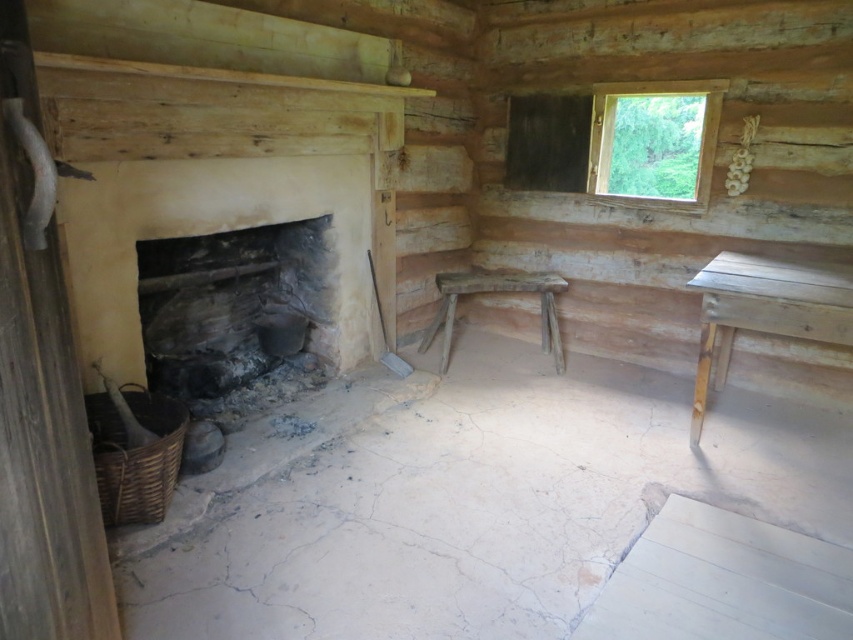
Who is positioned more to the right, charcoal gray stone fireplace at left or wooden table at right?

wooden table at right is more to the right.

Is charcoal gray stone fireplace at left thinner than wooden table at right?

Yes.

You are a GUI agent. You are given a task and a screenshot of the screen. Output one action in this format:
    pyautogui.click(x=<x>, y=<y>)
    Task: Click on the charcoal gray stone fireplace at left
    
    Given the screenshot: What is the action you would take?
    pyautogui.click(x=229, y=305)

Does point (283, 355) come farther from viewer compared to point (502, 278)?

No, (283, 355) is in front of (502, 278).

Is charcoal gray stone fireplace at left smaller than rustic wooden stool at center?

No.

Which is in front, point (173, 387) or point (561, 348)?

Positioned in front is point (173, 387).

This screenshot has height=640, width=853. I want to click on charcoal gray stone fireplace at left, so click(x=229, y=305).

Which is behind, point (328, 282) or point (662, 81)?

The point (662, 81) is behind.

Which of these two, charcoal gray stone fireplace at left or transparent wooden window at upper right, stands shorter?

With less height is transparent wooden window at upper right.

Where is `charcoal gray stone fireplace at left`? The image size is (853, 640). charcoal gray stone fireplace at left is located at coordinates (229, 305).

This screenshot has width=853, height=640. I want to click on charcoal gray stone fireplace at left, so click(229, 305).